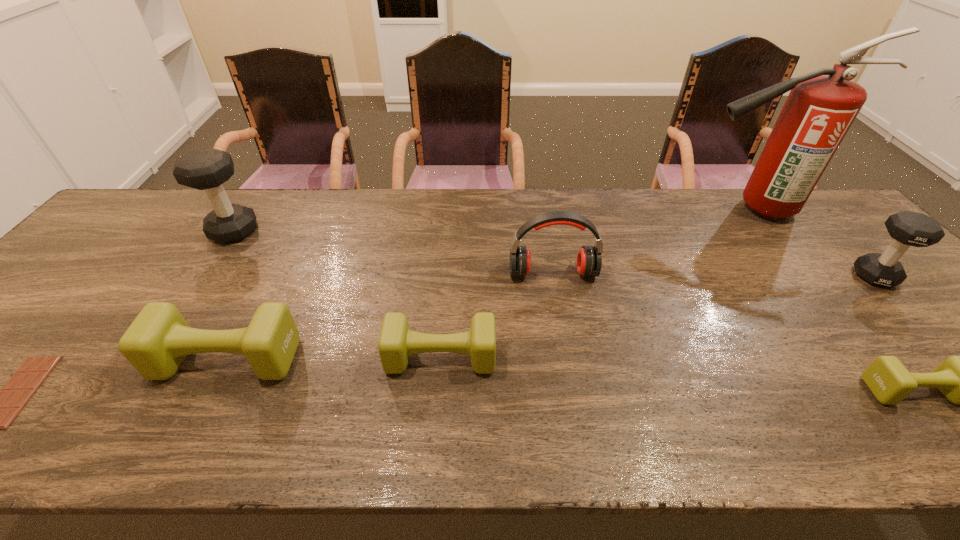
Locate an element on the screen. fire extinguisher that is at the far edge is located at coordinates (819, 110).

The height and width of the screenshot is (540, 960). I want to click on dumbbell located in the far edge section of the desktop, so click(x=207, y=169).

The height and width of the screenshot is (540, 960). Identify the location of fire extinguisher that is at the right edge. (819, 110).

At what (x,y) coordinates should I click in order to perform the action: click on dumbbell situated at the right edge. Please return your answer as a coordinate pair (x, y). This screenshot has height=540, width=960. Looking at the image, I should click on (907, 228).

I want to click on object that is at the far right corner, so click(x=819, y=110).

Where is `vacant region at the far edge of the desktop`? The height and width of the screenshot is (540, 960). vacant region at the far edge of the desktop is located at coordinates (457, 223).

Find the location of `vacant space at the near edge of the desktop`. vacant space at the near edge of the desktop is located at coordinates (157, 421).

The width and height of the screenshot is (960, 540). I want to click on blank space at the far left corner of the desktop, so click(x=172, y=191).

This screenshot has height=540, width=960. I want to click on vacant point located between the smaller gray dumbbell and the red earphone, so click(713, 274).

This screenshot has width=960, height=540. I want to click on empty location between the fifth object from left to right and the farthest dumbbell, so click(x=394, y=252).